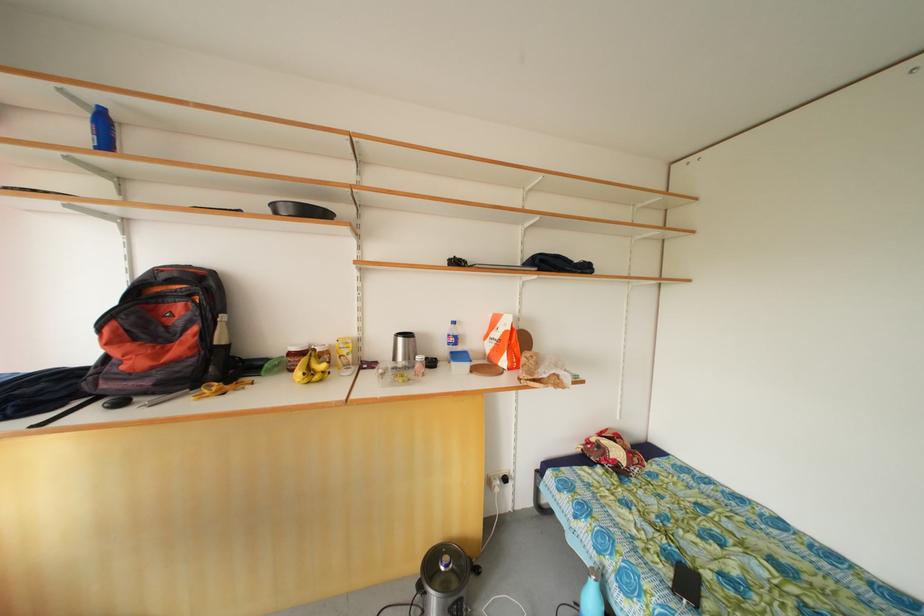
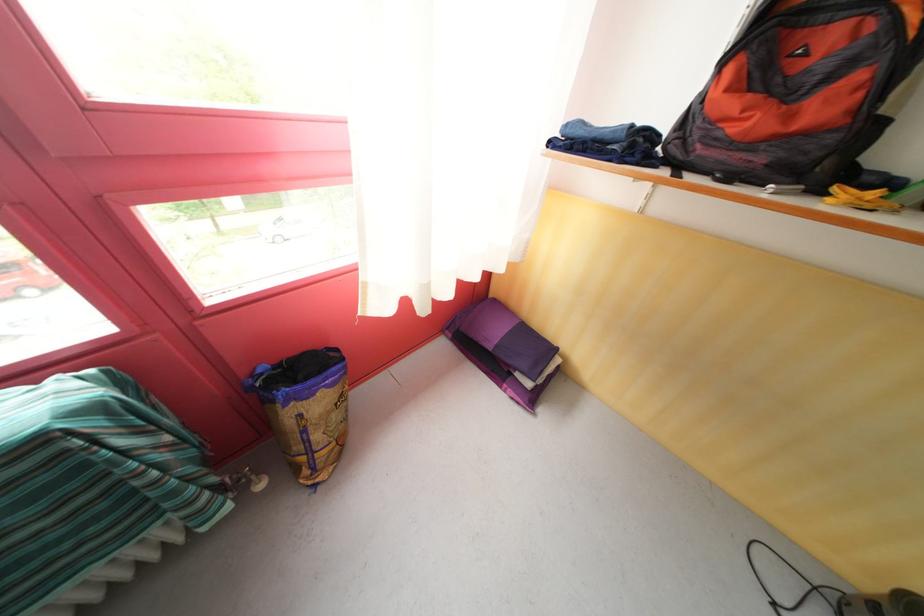
Based on the continuous images, in which direction is the camera rotating?

The camera's rotation is toward left-down.